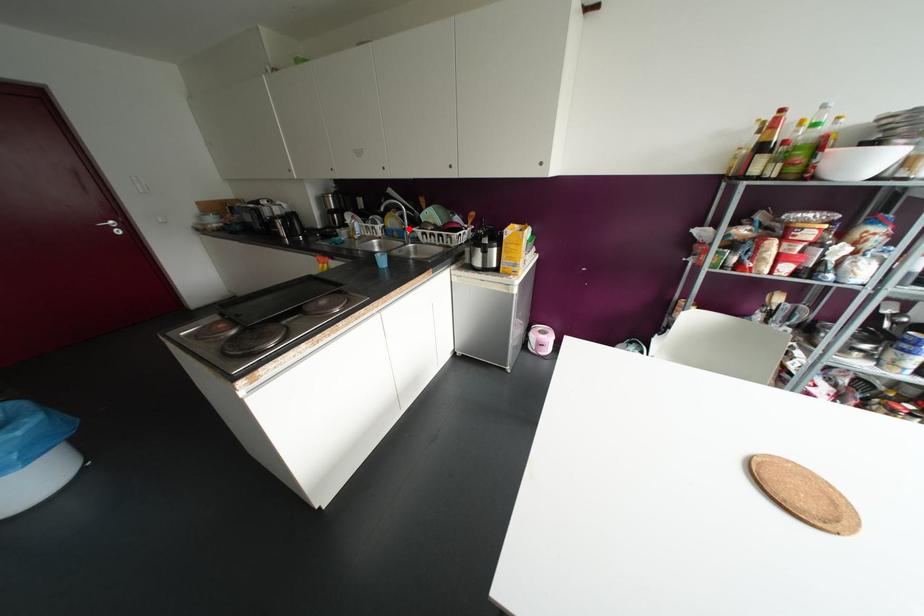
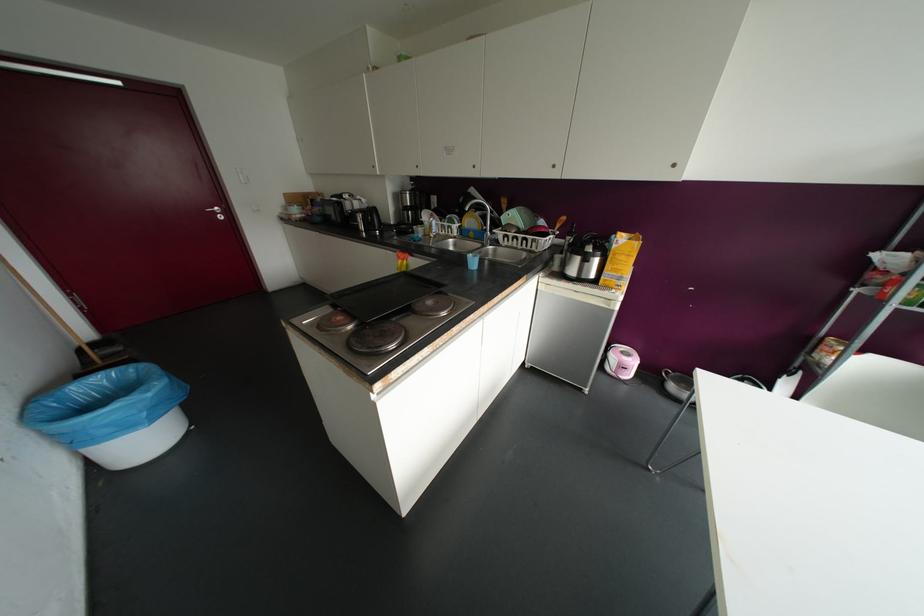
Find the pixel in the second image that matches the highlighted location in the first image.

(490, 230)